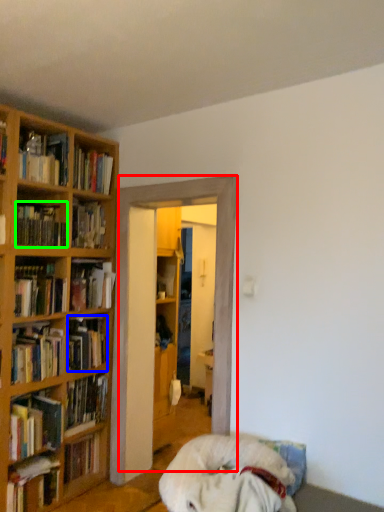
Question: Estimate the real-world distances between objects in this image. Which object is closer to entertainment center (highlighted by a red box), book (highlighted by a blue box) or book (highlighted by a green box)?

Choices:
 (A) book
 (B) book

Answer: (A)